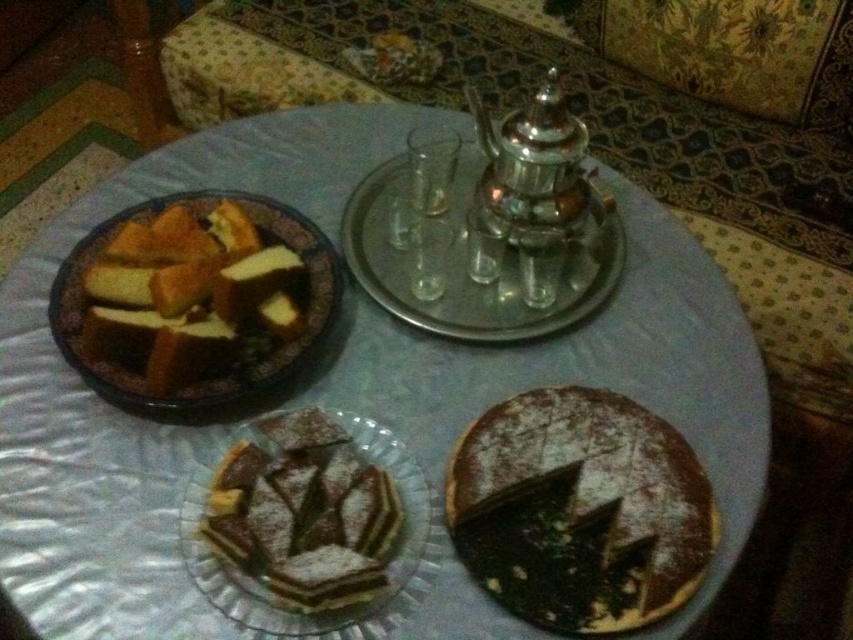
Question: Where is brown glazed plate at upper left located in relation to translucent glass plate at center in the image?

Choices:
 (A) above
 (B) below

Answer: (A)

Question: Is brown glazed plate at upper left above translucent glass plate at center?

Choices:
 (A) no
 (B) yes

Answer: (B)

Question: Among these objects, which one is farthest from the camera?

Choices:
 (A) brown glazed plate at upper left
 (B) powdered chocolate cake at lower right
 (C) metallic silver tray at upper center

Answer: (C)

Question: Is powdered chocolate cake at lower right closer to the viewer compared to translucent glass plate at center?

Choices:
 (A) yes
 (B) no

Answer: (B)

Question: Among these points, which one is nearest to the camera?

Choices:
 (A) (506, 545)
 (B) (451, 179)

Answer: (A)

Question: Which object is positioned closest to the powdered chocolate cake at lower right?

Choices:
 (A) metallic silver tray at upper center
 (B) brown glazed plate at upper left

Answer: (A)